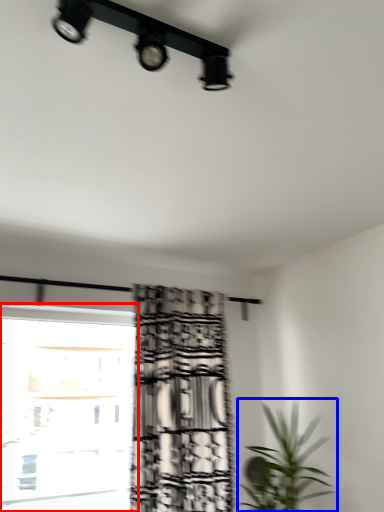
Question: Which object appears closest to the camera in this image, window (highlighted by a red box) or houseplant (highlighted by a blue box)?

Choices:
 (A) window
 (B) houseplant

Answer: (B)